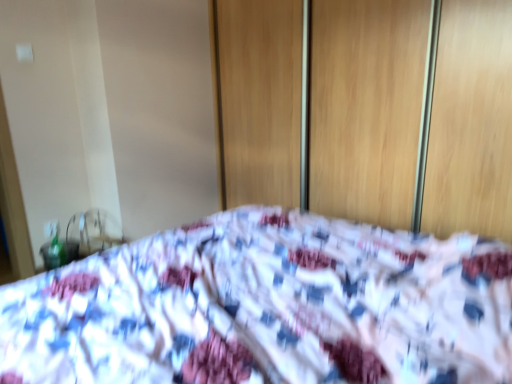
Question: Is fluffy fabric bed at center positioned with its back to wooden screen door at center?

Choices:
 (A) yes
 (B) no

Answer: (B)

Question: Could wooden screen door at center be considered to be inside fluffy fabric bed at center?

Choices:
 (A) no
 (B) yes

Answer: (A)

Question: From the image's perspective, is fluffy fabric bed at center located beneath wooden screen door at center?

Choices:
 (A) yes
 (B) no

Answer: (A)

Question: Can you confirm if fluffy fabric bed at center is positioned to the right of wooden screen door at center?

Choices:
 (A) no
 (B) yes

Answer: (A)

Question: Is fluffy fabric bed at center positioned beyond the bounds of wooden screen door at center?

Choices:
 (A) yes
 (B) no

Answer: (A)

Question: Does fluffy fabric bed at center appear on the left side of wooden screen door at center?

Choices:
 (A) no
 (B) yes

Answer: (B)

Question: Would you say wooden screen door at center is outside fluffy fabric bed at center?

Choices:
 (A) no
 (B) yes

Answer: (B)

Question: From the image's perspective, is wooden screen door at center located beneath fluffy fabric bed at center?

Choices:
 (A) yes
 (B) no

Answer: (B)

Question: Is there a large distance between wooden screen door at center and fluffy fabric bed at center?

Choices:
 (A) yes
 (B) no

Answer: (A)

Question: From a real-world perspective, is wooden screen door at center physically above fluffy fabric bed at center?

Choices:
 (A) yes
 (B) no

Answer: (A)

Question: Considering the relative sizes of wooden screen door at center and fluffy fabric bed at center in the image provided, is wooden screen door at center bigger than fluffy fabric bed at center?

Choices:
 (A) yes
 (B) no

Answer: (B)

Question: Can you confirm if wooden screen door at center is smaller than fluffy fabric bed at center?

Choices:
 (A) yes
 (B) no

Answer: (A)

Question: From a real-world perspective, is wooden screen door at center physically located above or below fluffy fabric bed at center?

Choices:
 (A) below
 (B) above

Answer: (B)